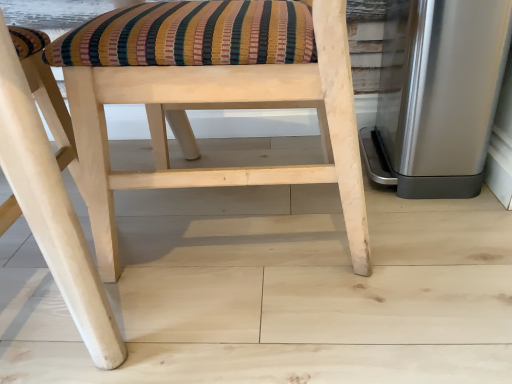
Identify the location of free point below natural wood chair at center, which ranks as the second chair in left-to-right order (from a real-world perspective). (273, 222).